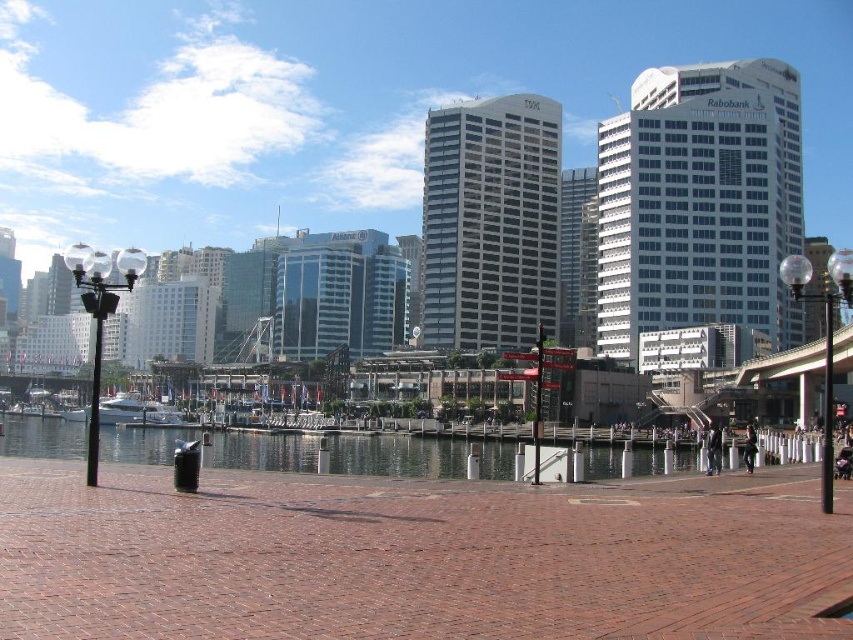
You are a photographer standing on the waterfront and want to capture the reflection of the white glossy boat at center in the clear water at center. Is the boat reflected in the water?

The clear water at center is positioned under the white glossy boat at center, so yes, the boat is reflected in the water.

From the picture: You are standing at the waterfront and want to walk from the point at coordinates point (73, 442) to the point at coordinates point (128, 401). Which direction should you face to move towards the second point?

To move from point (73, 442) to point (128, 401), you should face towards the direction where the second point is located. Since point (73, 442) is in front of point (128, 401), you would need to turn around and face backward to move towards the second point.

You are a photographer standing on the waterfront and want to capture the clear water at center and the white glossy boat at center in your shot. Which object appears larger in the photo?

The clear water at center appears larger in the photo because it is taller than the white glossy boat at center.